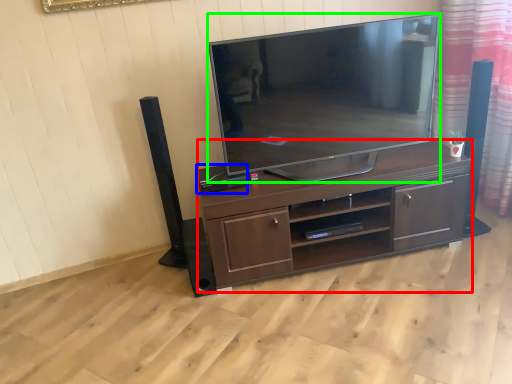
Question: Which object is the closest to the desk (highlighted by a red box)? Choose among these: speaker (highlighted by a blue box) or television (highlighted by a green box).

Choices:
 (A) speaker
 (B) television

Answer: (B)